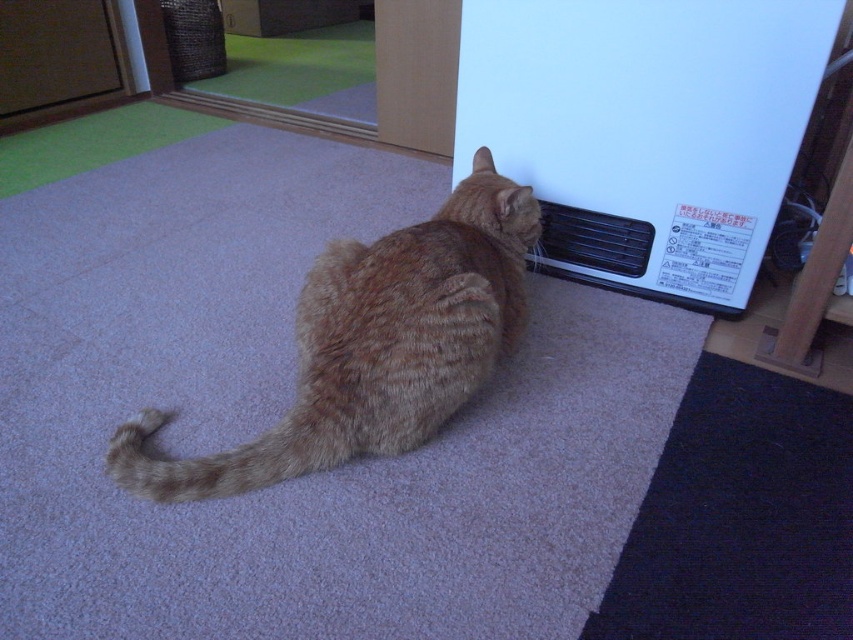
Measure the distance between white plastic heater at lower right and orange tabby cat at center.

A distance of 21.64 inches exists between white plastic heater at lower right and orange tabby cat at center.

Locate an element on the screen. The image size is (853, 640). white plastic heater at lower right is located at coordinates (645, 129).

Is point (467, 141) positioned in front of point (421, 388)?

No, (467, 141) is behind (421, 388).

Image resolution: width=853 pixels, height=640 pixels. I want to click on white plastic heater at lower right, so click(645, 129).